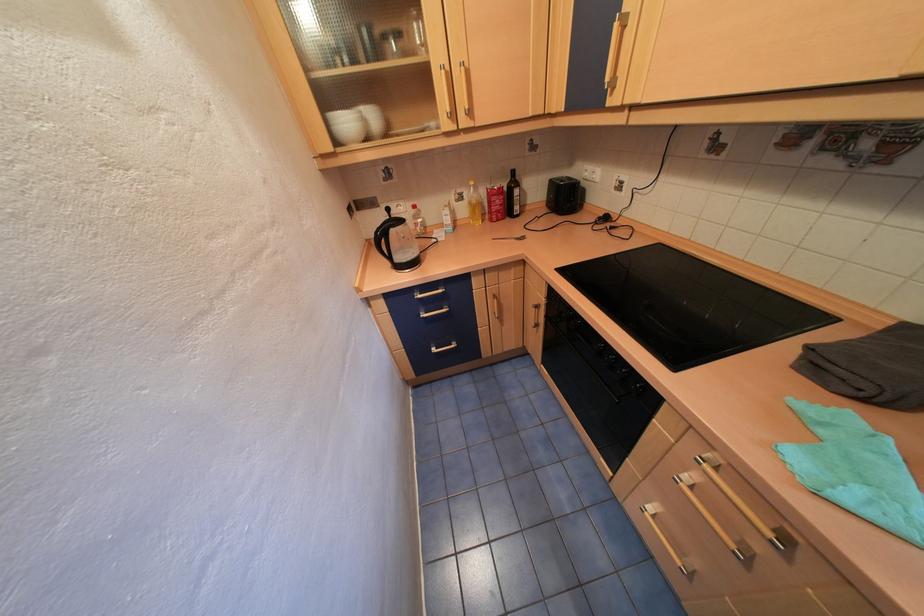
You are a GUI agent. You are given a task and a screenshot of the screen. Output one action in this format:
    pyautogui.click(x=<x>, y=<y>)
    Task: Click on the lower cabinet handle
    The width and height of the screenshot is (924, 616).
    Given the screenshot: What is the action you would take?
    pyautogui.click(x=536, y=315)